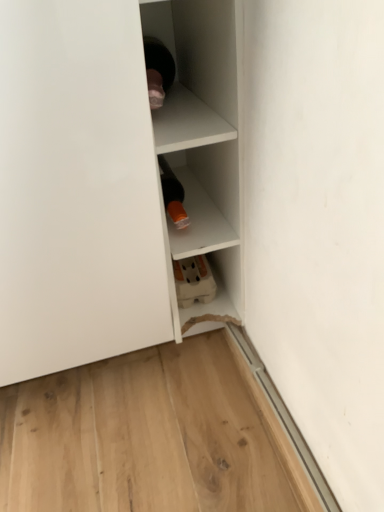
Question: From the image's perspective, is white matte shelf at upper left, the 2th shelf positioned from the right, on white matte shelf at center, positioned as the 1th shelf in right-to-left order?

Choices:
 (A) yes
 (B) no

Answer: (B)

Question: Is white matte shelf at upper left, the 1th shelf positioned from the left, positioned with its back to white matte shelf at center, which appears as the second shelf when viewed from the left?

Choices:
 (A) yes
 (B) no

Answer: (B)

Question: Is white matte shelf at upper left, the 2th shelf positioned from the right, closer to the viewer compared to white matte shelf at center, which appears as the second shelf when viewed from the left?

Choices:
 (A) no
 (B) yes

Answer: (B)

Question: Is white matte shelf at upper left, the 1th shelf positioned from the left, taller than white matte shelf at center, positioned as the 1th shelf in right-to-left order?

Choices:
 (A) yes
 (B) no

Answer: (B)

Question: Is white matte shelf at upper left, the 2th shelf positioned from the right, outside of white matte shelf at center, which appears as the second shelf when viewed from the left?

Choices:
 (A) yes
 (B) no

Answer: (A)

Question: Does white matte shelf at upper left, the 2th shelf positioned from the right, have a lesser width compared to white matte shelf at center, positioned as the 1th shelf in right-to-left order?

Choices:
 (A) yes
 (B) no

Answer: (B)

Question: Does white matte shelf at center, positioned as the 1th shelf in right-to-left order, have a lesser width compared to white matte shelf at upper left, the 1th shelf positioned from the left?

Choices:
 (A) no
 (B) yes

Answer: (B)

Question: Is white matte shelf at center, positioned as the 1th shelf in right-to-left order, positioned before white matte shelf at upper left, the 1th shelf positioned from the left?

Choices:
 (A) no
 (B) yes

Answer: (A)

Question: Does white matte shelf at center, positioned as the 1th shelf in right-to-left order, turn towards white matte shelf at upper left, the 2th shelf positioned from the right?

Choices:
 (A) yes
 (B) no

Answer: (B)

Question: Can we say white matte shelf at center, positioned as the 1th shelf in right-to-left order, lies outside white matte shelf at upper left, the 2th shelf positioned from the right?

Choices:
 (A) no
 (B) yes

Answer: (B)

Question: Is white matte shelf at center, positioned as the 1th shelf in right-to-left order, at the right side of white matte shelf at upper left, the 2th shelf positioned from the right?

Choices:
 (A) no
 (B) yes

Answer: (B)

Question: Is white matte shelf at center, which appears as the second shelf when viewed from the left, smaller than white matte shelf at upper left, the 2th shelf positioned from the right?

Choices:
 (A) no
 (B) yes

Answer: (B)

Question: Is white matte shelf at upper left, the 1th shelf positioned from the left, taller or shorter than white matte shelf at center, positioned as the 1th shelf in right-to-left order?

Choices:
 (A) tall
 (B) short

Answer: (B)